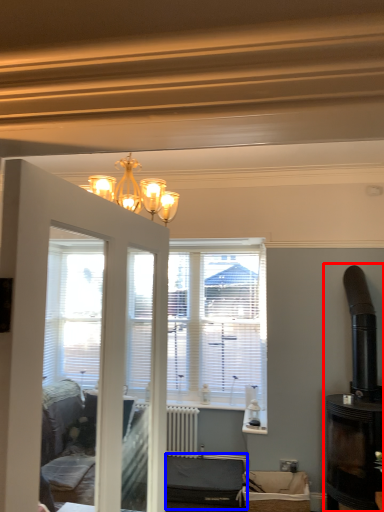
Question: Which object is further to the camera taking this photo, fireplace (highlighted by a red box) or furniture (highlighted by a blue box)?

Choices:
 (A) fireplace
 (B) furniture

Answer: (B)